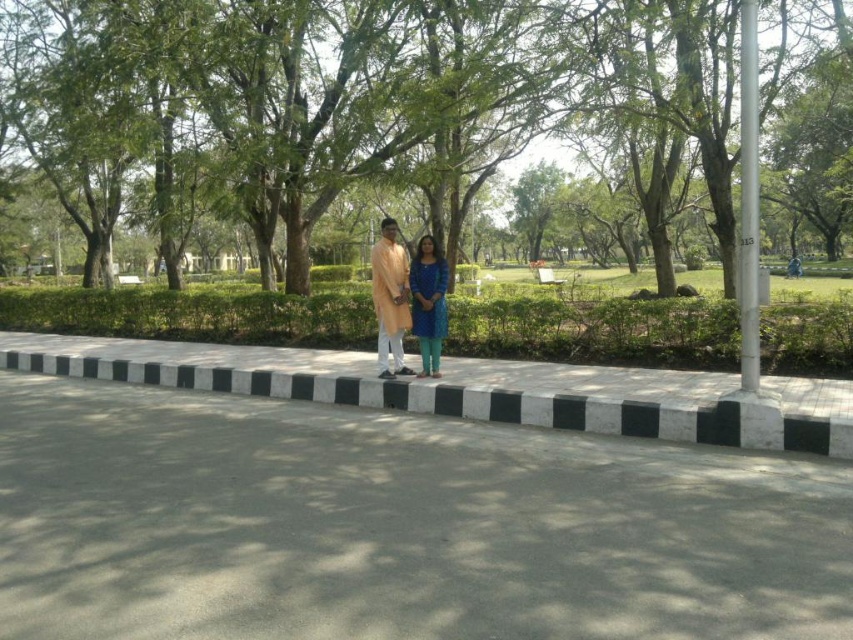
Which is above, matte orange kurta at center or teal fabric dress at center?

matte orange kurta at center

Does matte orange kurta at center lie in front of teal fabric dress at center?

No, matte orange kurta at center is further to the viewer.

Which is behind, point (384, 252) or point (413, 257)?

Point (413, 257)

This screenshot has height=640, width=853. What are the coordinates of `matte orange kurta at center` in the screenshot? It's located at (395, 298).

Is black and white concrete curb at center thinner than white metallic pole at right?

No.

Can you confirm if black and white concrete curb at center is positioned below white metallic pole at right?

Correct, black and white concrete curb at center is located below white metallic pole at right.

Who is more forward, (485, 419) or (755, 77)?

Point (755, 77) is more forward.

Where is `black and white concrete curb at center`? The image size is (853, 640). black and white concrete curb at center is located at coordinates (457, 396).

Is gray asphalt pavement at center smaller than black and white concrete curb at center?

Correct, gray asphalt pavement at center occupies less space than black and white concrete curb at center.

Is gray asphalt pavement at center below black and white concrete curb at center?

Yes, gray asphalt pavement at center is below black and white concrete curb at center.

Is point (631, 586) behind point (204, 372)?

No.

The image size is (853, 640). In order to click on gray asphalt pavement at center in this screenshot , I will do `click(396, 525)`.